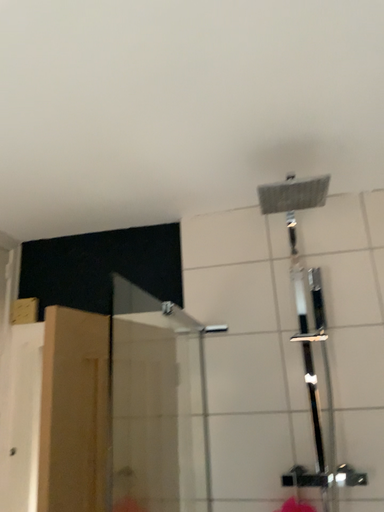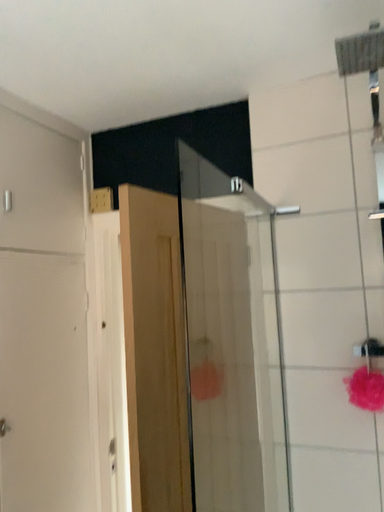
Question: Which way did the camera rotate in the video?

Choices:
 (A) rotated right
 (B) rotated left

Answer: (B)